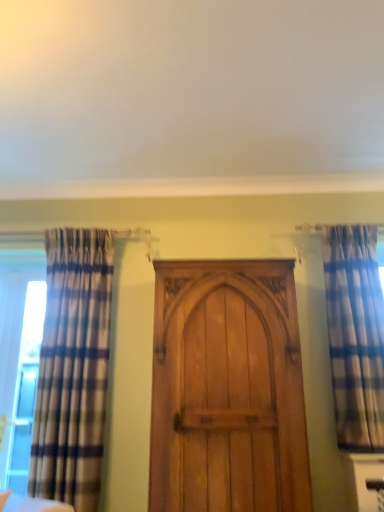
Question: From a real-world perspective, is light brown wood door at center located beneath clear glass window at left?

Choices:
 (A) yes
 (B) no

Answer: (A)

Question: Does light brown wood door at center turn towards clear glass window at left?

Choices:
 (A) yes
 (B) no

Answer: (B)

Question: Are light brown wood door at center and clear glass window at left beside each other?

Choices:
 (A) no
 (B) yes

Answer: (A)

Question: Is light brown wood door at center to the right of clear glass window at left from the viewer's perspective?

Choices:
 (A) no
 (B) yes

Answer: (B)

Question: Can you confirm if light brown wood door at center is thinner than clear glass window at left?

Choices:
 (A) yes
 (B) no

Answer: (B)

Question: Is light brown wood door at center oriented away from clear glass window at left?

Choices:
 (A) no
 (B) yes

Answer: (A)

Question: From a real-world perspective, is plaid fabric curtain at left, the second curtain in the right-to-left sequence, physically above clear glass window at left?

Choices:
 (A) yes
 (B) no

Answer: (B)

Question: From the image's perspective, is plaid fabric curtain at left, the second curtain in the right-to-left sequence, under clear glass window at left?

Choices:
 (A) yes
 (B) no

Answer: (B)

Question: Is plaid fabric curtain at left, which appears as the first curtain when viewed from the left, facing towards clear glass window at left?

Choices:
 (A) yes
 (B) no

Answer: (B)

Question: Does plaid fabric curtain at left, which appears as the first curtain when viewed from the left, have a greater width compared to clear glass window at left?

Choices:
 (A) yes
 (B) no

Answer: (B)

Question: From a real-world perspective, is plaid fabric curtain at left, which appears as the first curtain when viewed from the left, beneath clear glass window at left?

Choices:
 (A) yes
 (B) no

Answer: (A)

Question: Is plaid fabric curtain at left, which appears as the first curtain when viewed from the left, oriented away from clear glass window at left?

Choices:
 (A) no
 (B) yes

Answer: (A)

Question: Is wooden door at center bigger than plaid fabric curtain at left, the second curtain in the right-to-left sequence?

Choices:
 (A) yes
 (B) no

Answer: (B)